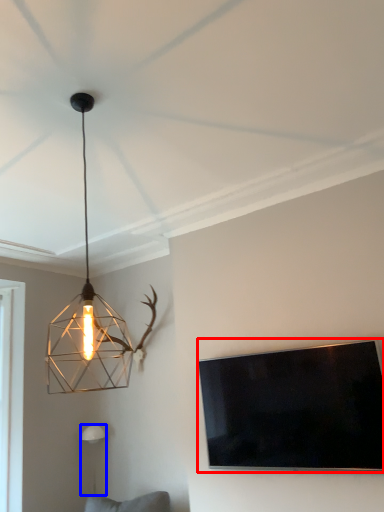
Question: Which object appears farthest to the camera in this image, television (highlighted by a red box) or lamp (highlighted by a blue box)?

Choices:
 (A) television
 (B) lamp

Answer: (B)